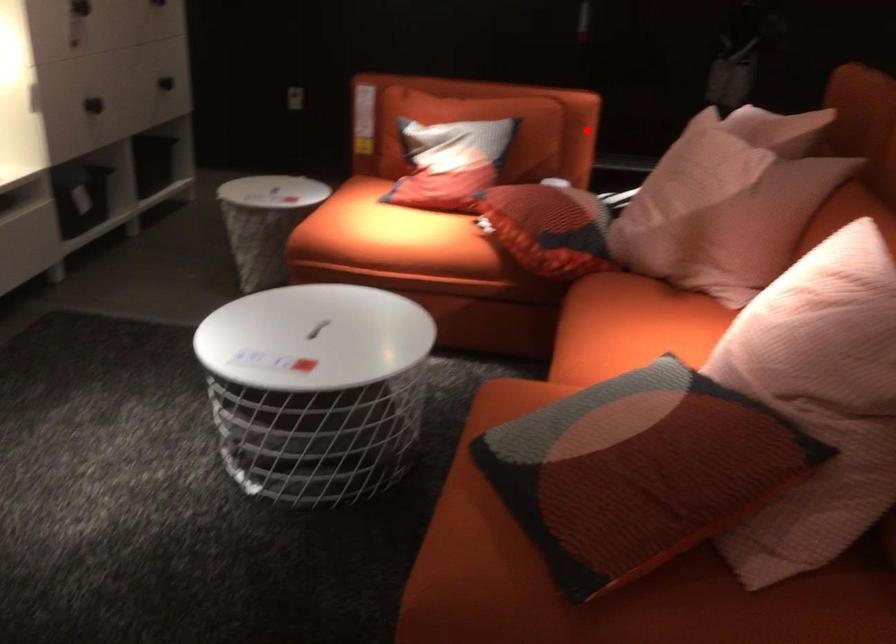
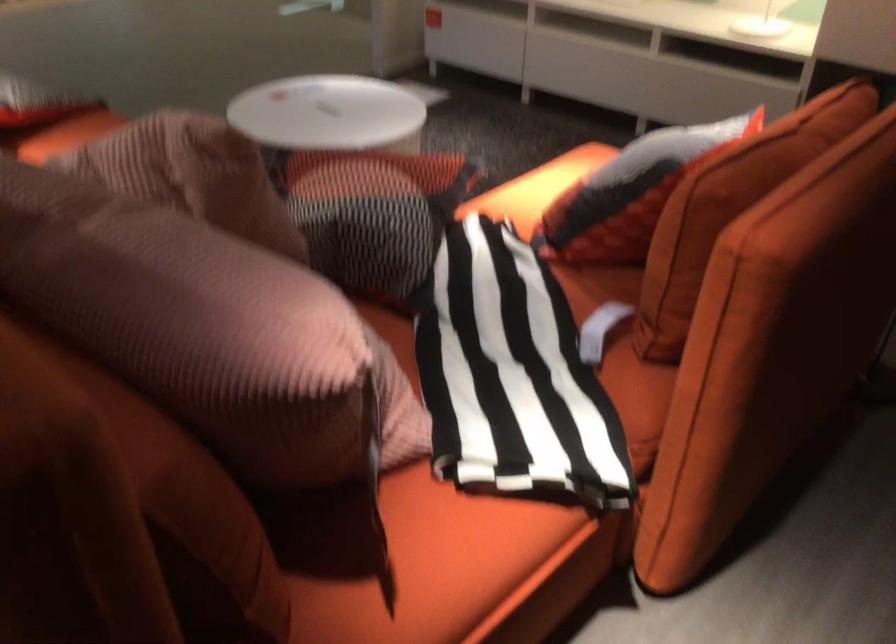
Question: I am providing you with two images of the same scene from different viewpoints. A red point is shown in image1. For the corresponding object point in image2, is it positioned nearer or farther from the camera?

Choices:
 (A) Nearer
 (B) Farther

Answer: (A)